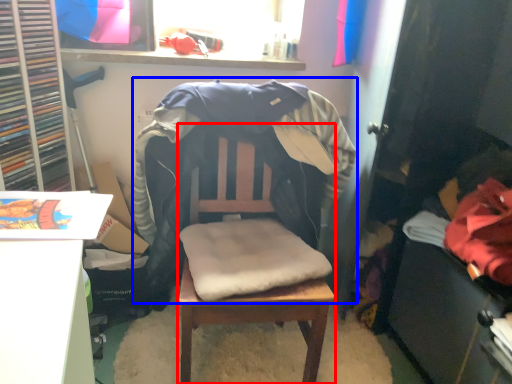
Question: Which point is closer to the camera, chair (highlighted by a red box) or bean bag chair (highlighted by a blue box)?

Choices:
 (A) chair
 (B) bean bag chair

Answer: (A)